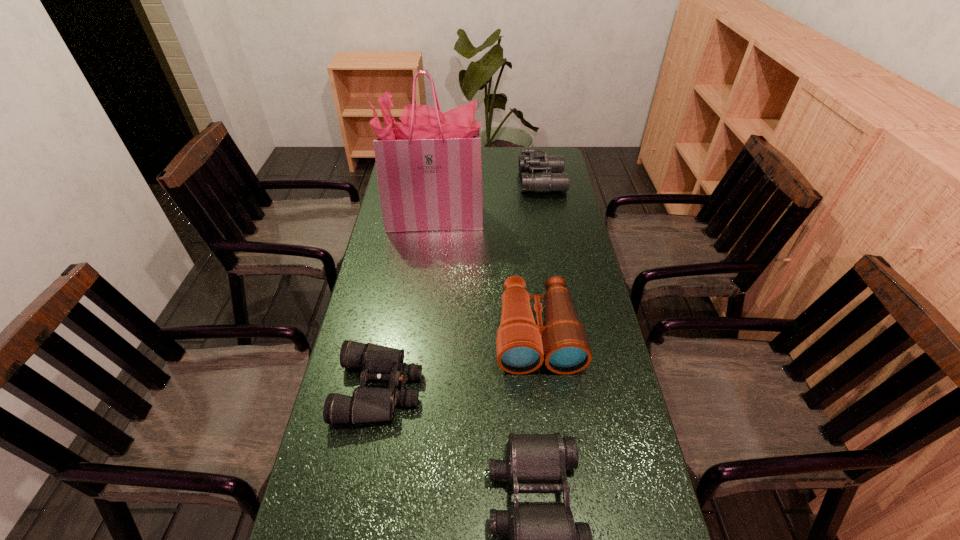
The height and width of the screenshot is (540, 960). I want to click on shopping bag, so click(429, 169).

At what (x,y) coordinates should I click in order to perform the action: click on the tallest object. Please return your answer as a coordinate pair (x, y). The width and height of the screenshot is (960, 540). Looking at the image, I should click on (429, 169).

I want to click on the farthest object, so click(x=539, y=172).

Find the location of `the leftmost binoculars`. the leftmost binoculars is located at coordinates (379, 363).

The width and height of the screenshot is (960, 540). What are the coordinates of `the shortest object` in the screenshot? It's located at (379, 363).

The image size is (960, 540). What are the coordinates of `free space located 0.120m on the right of the fourth nearest object` in the screenshot? It's located at (516, 218).

Where is `free spot located through the lenses of the farthest object`? free spot located through the lenses of the farthest object is located at coordinates (441, 181).

Locate an element on the screen. The image size is (960, 540). blank space located 0.150m through the lenses of the farthest object is located at coordinates (484, 181).

Find the location of `vacant space located 0.080m through the lenses of the farthest object`. vacant space located 0.080m through the lenses of the farthest object is located at coordinates (x=500, y=181).

The image size is (960, 540). What are the coordinates of `blank area located through the eyepieces of the shortest binoculars` in the screenshot? It's located at (499, 388).